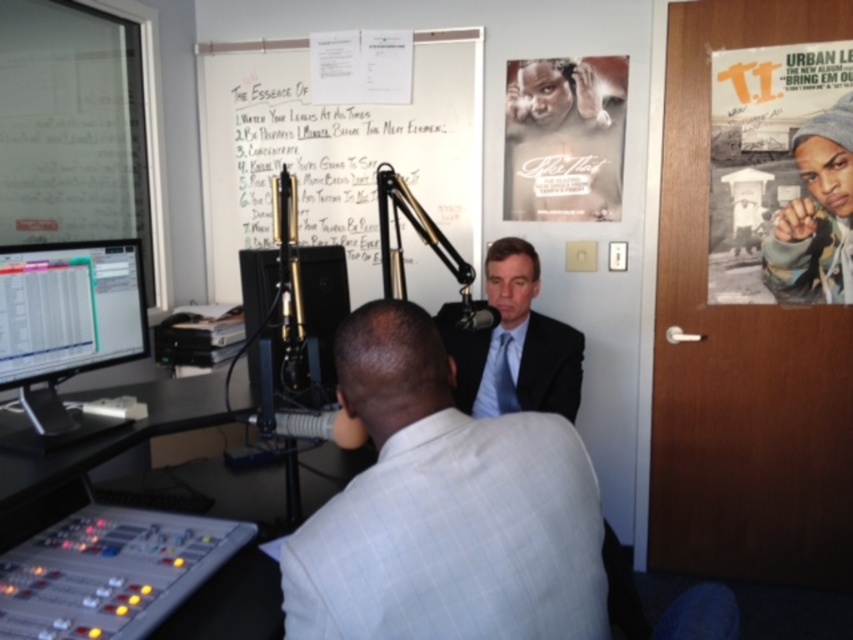
Looking at this image, in the radio studio scene, there is a whiteboard at upper center and a black matte poster at upper right. Which object is wider?

The whiteboard at upper center is wider than the black matte poster at upper right.

You are a technician in the radio studio and need to adjust the microphone stand. You have to move from the white textured suit at center to the matte black monitor at left. Which object will you pass by first?

The white textured suit at center is closer to the viewer than the matte black monitor at left, so you will pass by the white textured suit at center first when moving towards the matte black monitor at left.

You are a guest in a radio studio and need to find the white textured suit at center. The studio has a coordinate system where the bottom left corner is the origin. Can you confirm if the white textured suit at center is located at point (445, 508)?

Yes, the white textured suit at center is located at point (445, 508).